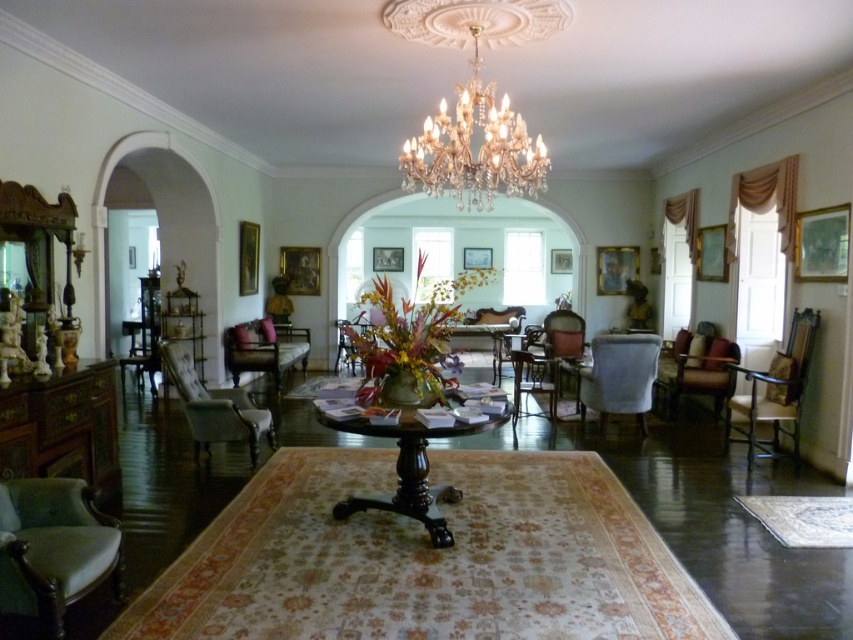
Is velvet green armchair at center-left wider than velvet upholstered armchair at center?

Yes.

Which is behind, point (248, 328) or point (363, 328)?

The point (363, 328) is more distant.

The width and height of the screenshot is (853, 640). Identify the location of velvet green armchair at center-left. (264, 348).

Who is positioned more to the right, multicolored floral arrangement at center or velvet brown armchair at right?

velvet brown armchair at right

Which of these two, multicolored floral arrangement at center or velvet brown armchair at right, stands taller?

Standing taller between the two is multicolored floral arrangement at center.

Identify the location of multicolored floral arrangement at center. The width and height of the screenshot is (853, 640). 405,342.

Is point (639, 419) positioned before point (550, 362)?

Yes.

Between velvet blue armchair at center and wooden chair at center, which one is positioned higher?

wooden chair at center is higher up.

Find the location of a particular element. The width and height of the screenshot is (853, 640). velvet blue armchair at center is located at coordinates point(619,376).